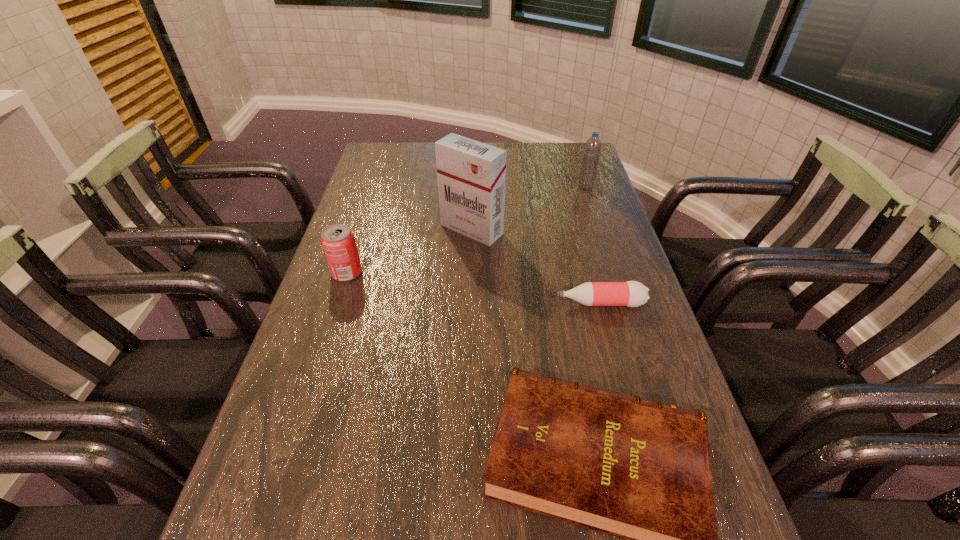
At what (x,y) coordinates should I click in order to perform the action: click on vacant region located with the cap open on the fourth farthest object. Please return your answer as a coordinate pair (x, y). The width and height of the screenshot is (960, 540). Looking at the image, I should click on (507, 303).

The height and width of the screenshot is (540, 960). In order to click on vacant space positioned with the cap open on the fourth farthest object in this screenshot , I will do `click(406, 303)`.

Identify the location of free space located 0.060m with the cap open on the fourth farthest object. (531, 303).

The width and height of the screenshot is (960, 540). I want to click on object at the left edge, so 338,242.

Find the location of a particular element. This screenshot has height=540, width=960. water bottle that is at the right edge is located at coordinates (592, 149).

Where is `bottle at the right edge`? The image size is (960, 540). bottle at the right edge is located at coordinates (631, 293).

Locate an element on the screen. The width and height of the screenshot is (960, 540). vacant region at the far edge of the desktop is located at coordinates (510, 145).

Where is `free space at the left edge of the desktop`? free space at the left edge of the desktop is located at coordinates (286, 427).

This screenshot has width=960, height=540. I want to click on free space at the right edge of the desktop, so click(x=578, y=218).

I want to click on blank region between the fourth farthest object and the farthest object, so click(592, 245).